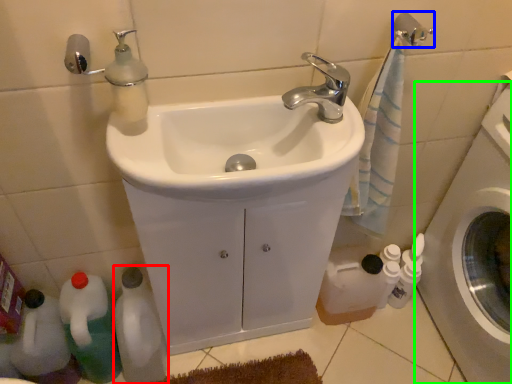
Question: Which object is the closest to the bottle (highlighted by a red box)? Choose among these: towel bar (highlighted by a blue box) or washing machine (highlighted by a green box).

Choices:
 (A) towel bar
 (B) washing machine

Answer: (B)